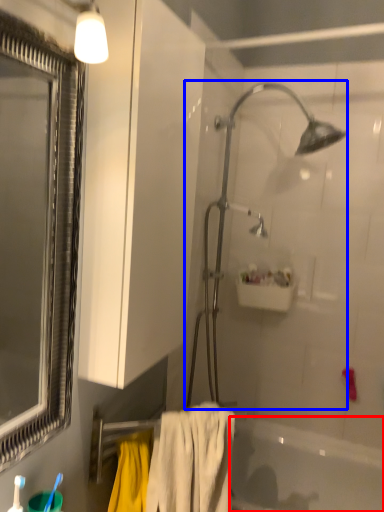
Question: Which object appears farthest to the camera in this image, bathtub (highlighted by a red box) or shower (highlighted by a blue box)?

Choices:
 (A) bathtub
 (B) shower

Answer: (B)